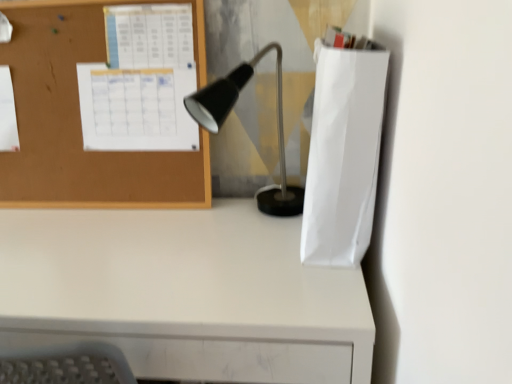
Locate an element on the screen. matte black lamp at center is located at coordinates (228, 114).

What do you see at coordinates (228, 114) in the screenshot?
I see `matte black lamp at center` at bounding box center [228, 114].

Describe the element at coordinates (343, 153) in the screenshot. Image resolution: width=512 pixels, height=384 pixels. I see `white matte paper bag at right` at that location.

Image resolution: width=512 pixels, height=384 pixels. Identify the location of white matte desk at lower left. (184, 294).

The width and height of the screenshot is (512, 384). In order to click on matte black lamp at center in this screenshot , I will do `click(228, 114)`.

Is point (335, 256) in front of point (306, 374)?

No, (335, 256) is further to viewer.

Can you confirm if white matte paper bag at right is positioned to the left of white matte desk at lower left?

Incorrect, white matte paper bag at right is not on the left side of white matte desk at lower left.

Would you say white matte paper bag at right is inside or outside white matte desk at lower left?

white matte paper bag at right is not enclosed by white matte desk at lower left.

In order to click on desk in front of the white matte paper bag at right in this screenshot , I will do `click(184, 294)`.

From a real-world perspective, who is located lower, matte black lamp at center or corkboard at upper left?

matte black lamp at center is physically lower.

How many degrees apart are the facing directions of matte black lamp at center and corkboard at upper left?

The angle between the facing direction of matte black lamp at center and the facing direction of corkboard at upper left is 35.4 degrees.

From the image's perspective, relative to corkboard at upper left, is matte black lamp at center above or below?

matte black lamp at center is below corkboard at upper left.

Measure the distance from matte black lamp at center to corkboard at upper left.

matte black lamp at center and corkboard at upper left are 11.74 inches apart.

You are a GUI agent. You are given a task and a screenshot of the screen. Output one action in this format:
    pyautogui.click(x=<x>, y=<y>)
    Task: Click on the paper bag in front of the matte black lamp at center
    
    Given the screenshot: What is the action you would take?
    pyautogui.click(x=343, y=153)

Could you tell me if matte black lamp at center is facing white matte paper bag at right?

No, matte black lamp at center is not facing towards white matte paper bag at right.

Consider the image. Can we say matte black lamp at center lies outside white matte paper bag at right?

matte black lamp at center lies outside white matte paper bag at right's area.

Which object is wider, matte black lamp at center or white matte paper bag at right?

With larger width is matte black lamp at center.

Between corkboard at upper left and white matte paper bag at right, which one appears on the right side from the viewer's perspective?

white matte paper bag at right is more to the right.

Is corkboard at upper left situated inside white matte paper bag at right or outside?

corkboard at upper left lies outside white matte paper bag at right.

Which is behind, point (49, 85) or point (316, 247)?

The point (49, 85) is behind.

Where is `bulletin board on the left of white matte paper bag at right`? Image resolution: width=512 pixels, height=384 pixels. bulletin board on the left of white matte paper bag at right is located at coordinates (80, 119).

Looking at this image, what's the angular difference between white matte paper bag at right and matte black lamp at center's facing directions?

The angle between the facing direction of white matte paper bag at right and the facing direction of matte black lamp at center is 59.6 degrees.

From the picture: Choose the correct answer: Is white matte paper bag at right inside matte black lamp at center or outside it?

white matte paper bag at right lies outside matte black lamp at center.

Which of these two, white matte paper bag at right or matte black lamp at center, is wider?

matte black lamp at center is wider.

From the image's perspective, is white matte paper bag at right beneath matte black lamp at center?

Yes, from the image's perspective, white matte paper bag at right is below matte black lamp at center.

Looking at this image, between white matte desk at lower left and white matte paper bag at right, which one has larger size?

white matte desk at lower left.

Considering the points (219, 219) and (331, 241), which point is behind, point (219, 219) or point (331, 241)?

The point (219, 219) is behind.

In the image, is white matte desk at lower left on the left side or the right side of white matte paper bag at right?

white matte desk at lower left is to the left of white matte paper bag at right.

Considering the relative sizes of white matte paper bag at right and corkboard at upper left in the image provided, is white matte paper bag at right wider than corkboard at upper left?

Indeed, white matte paper bag at right has a greater width compared to corkboard at upper left.

Which is behind, point (376, 74) or point (29, 34)?

The point (29, 34) is behind.

Is white matte paper bag at right inside or outside of corkboard at upper left?

white matte paper bag at right lies outside corkboard at upper left.

Is white matte paper bag at right facing away from corkboard at upper left?

No, white matte paper bag at right is not facing away from corkboard at upper left.

This screenshot has width=512, height=384. What are the coordinates of `paper bag behind the white matte desk at lower left` in the screenshot? It's located at (343, 153).

This screenshot has height=384, width=512. I want to click on lamp below the corkboard at upper left (from the image's perspective), so click(228, 114).

Looking at the image, which one is located closer to corkboard at upper left, matte black lamp at center or white matte paper bag at right?

matte black lamp at center is positioned closer to the anchor corkboard at upper left.

When comparing their distances from matte black lamp at center, does white matte paper bag at right or white matte desk at lower left seem closer?

The object closer to matte black lamp at center is white matte paper bag at right.

From the image, which object appears to be farther from white matte paper bag at right, matte black lamp at center or white matte desk at lower left?

Among the two, white matte desk at lower left is located further to white matte paper bag at right.

In the scene shown: Considering their positions, is white matte desk at lower left positioned closer to corkboard at upper left than white matte paper bag at right?

The object closer to corkboard at upper left is white matte desk at lower left.

Which object lies further to the anchor point white matte desk at lower left, matte black lamp at center or white matte paper bag at right?

Among the two, matte black lamp at center is located further to white matte desk at lower left.

Based on their spatial positions, is corkboard at upper left or white matte paper bag at right further from white matte desk at lower left?

Among the two, corkboard at upper left is located further to white matte desk at lower left.

Which object lies nearer to the anchor point matte black lamp at center, corkboard at upper left or white matte paper bag at right?

white matte paper bag at right lies closer to matte black lamp at center than the other object.

Estimate the real-world distances between objects in this image. Which object is closer to matte black lamp at center, white matte desk at lower left or corkboard at upper left?

Among the two, corkboard at upper left is located nearer to matte black lamp at center.

This screenshot has width=512, height=384. In order to click on lamp between corkboard at upper left and white matte paper bag at right in this screenshot , I will do `click(228, 114)`.

This screenshot has width=512, height=384. I want to click on lamp between corkboard at upper left and white matte desk at lower left vertically, so click(x=228, y=114).

Identify the location of desk between corkboard at upper left and white matte paper bag at right in the horizontal direction. The width and height of the screenshot is (512, 384). (184, 294).

Where is `paper bag that lies between matte black lamp at center and white matte desk at lower left from top to bottom`? This screenshot has width=512, height=384. paper bag that lies between matte black lamp at center and white matte desk at lower left from top to bottom is located at coordinates (343, 153).